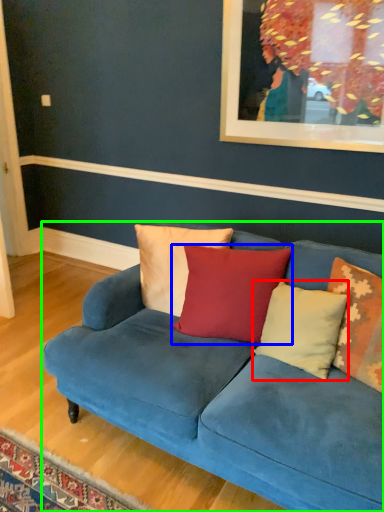
Question: Which object is positioned closest to pillow (highlighted by a red box)? Select from pillow (highlighted by a blue box) and studio couch (highlighted by a green box).

Choices:
 (A) pillow
 (B) studio couch

Answer: (A)